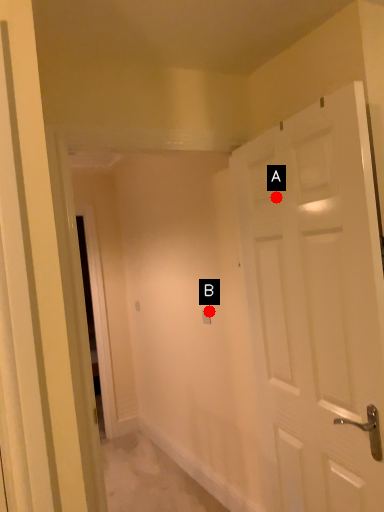
Question: Two points are circled on the image, labeled by A and B beside each circle. Which of the following is the farthest from the observer?

Choices:
 (A) A is further
 (B) B is further

Answer: (B)